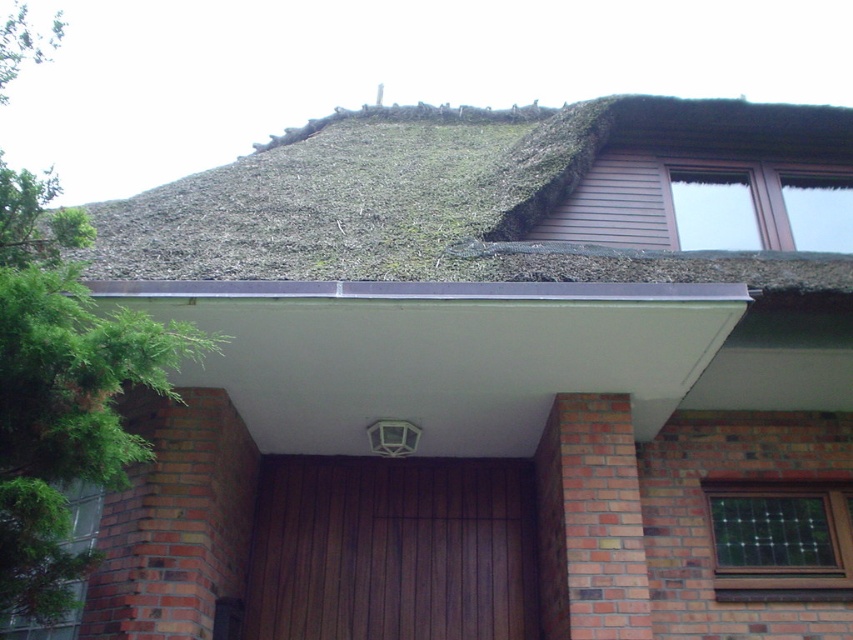
You are standing in front of the house and want to enter through the brown wooden door at center. Which direction should you move relative to the green thatch roof at upper center to reach the door?

You should move to the left relative to the green thatch roof at upper center because the brown wooden door at center is located to the left of the green thatch roof at upper center.

Based on the scene description, can you determine the 2D coordinates of the green thatch roof at upper center?

The 2D coordinates of the green thatch roof at upper center are at point (x=456, y=196).